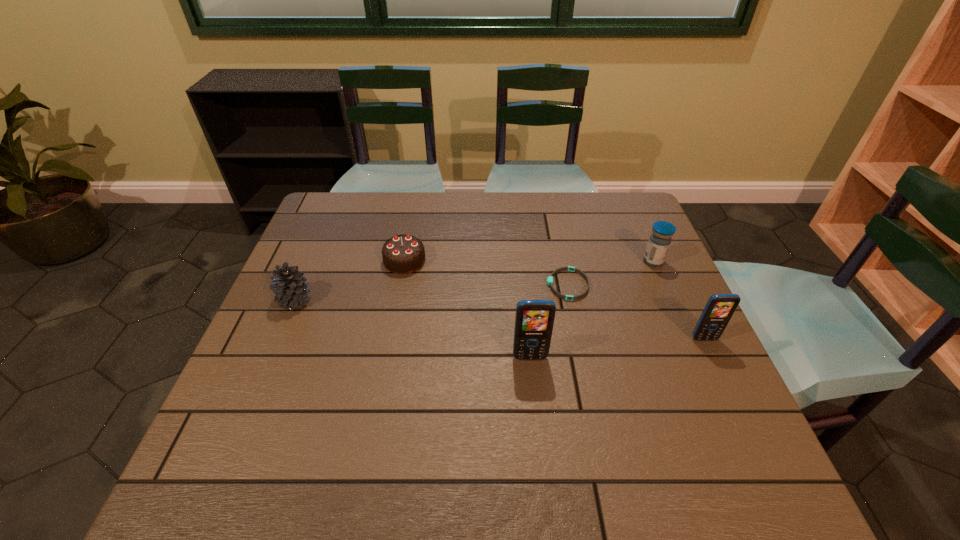
This screenshot has height=540, width=960. I want to click on medicine present at the right edge, so click(660, 239).

Locate an element on the screen. vacant space at the far edge of the desktop is located at coordinates (424, 202).

Find the location of `free location at the near edge`. free location at the near edge is located at coordinates (431, 417).

Where is `vacant region at the left edge of the desktop`? vacant region at the left edge of the desktop is located at coordinates (334, 276).

This screenshot has height=540, width=960. Find the location of `vacant space at the far left corner of the desktop`. vacant space at the far left corner of the desktop is located at coordinates (337, 216).

This screenshot has height=540, width=960. In the image, there is a desktop. What are the coordinates of `free space at the far right corner` in the screenshot? It's located at [x=630, y=231].

The height and width of the screenshot is (540, 960). Find the location of `vacant point located between the pinecone and the medicine`. vacant point located between the pinecone and the medicine is located at coordinates (474, 281).

This screenshot has width=960, height=540. I want to click on free spot between the second object from left to right and the pinecone, so click(349, 281).

Where is `vacant region between the nearer cellular telephone and the leftmost object`? The width and height of the screenshot is (960, 540). vacant region between the nearer cellular telephone and the leftmost object is located at coordinates (413, 329).

The height and width of the screenshot is (540, 960). Find the location of `empty space that is in between the medicine and the shortest object`. empty space that is in between the medicine and the shortest object is located at coordinates (611, 273).